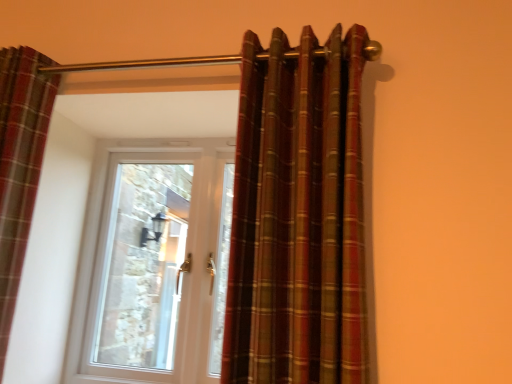
Describe the element at coordinates (298, 214) in the screenshot. The height and width of the screenshot is (384, 512). I see `plaid fabric curtain at center, positioned as the 1th curtain in right-to-left order` at that location.

Measure the distance between point (160, 292) and camera.

They are 14.54 feet apart.

Find the location of `white plastic door at center`. white plastic door at center is located at coordinates (149, 263).

The width and height of the screenshot is (512, 384). What do you see at coordinates (20, 164) in the screenshot? I see `plaid fabric curtain at left, which ranks as the second curtain in right-to-left order` at bounding box center [20, 164].

Locate an element on the screen. The width and height of the screenshot is (512, 384). plaid fabric curtain at center, positioned as the 1th curtain in right-to-left order is located at coordinates (298, 214).

Which object is wider, plaid fabric curtain at left, which is counted as the first curtain, starting from the left, or plaid fabric curtain at center, the 2th curtain in the left-to-right sequence?

plaid fabric curtain at center, the 2th curtain in the left-to-right sequence, is wider.

Considering their positions, is plaid fabric curtain at left, which is counted as the first curtain, starting from the left, located in front of or behind plaid fabric curtain at center, the 2th curtain in the left-to-right sequence?

In the image, plaid fabric curtain at left, which is counted as the first curtain, starting from the left, appears behind plaid fabric curtain at center, the 2th curtain in the left-to-right sequence.

Considering the sizes of plaid fabric curtain at left, which is counted as the first curtain, starting from the left, and plaid fabric curtain at center, the 2th curtain in the left-to-right sequence, in the image, is plaid fabric curtain at left, which is counted as the first curtain, starting from the left, taller or shorter than plaid fabric curtain at center, the 2th curtain in the left-to-right sequence,?

plaid fabric curtain at left, which is counted as the first curtain, starting from the left, is taller than plaid fabric curtain at center, the 2th curtain in the left-to-right sequence.

Find the location of a particular element. The image size is (512, 384). curtain located in front of the plaid fabric curtain at left, which is counted as the first curtain, starting from the left is located at coordinates (298, 214).

Between white plastic door at center and plaid fabric curtain at center, the 2th curtain in the left-to-right sequence, which one is positioned behind?

white plastic door at center is further from the camera.

From a real-world perspective, which is physically above, white plastic door at center or plaid fabric curtain at center, the 2th curtain in the left-to-right sequence?

plaid fabric curtain at center, the 2th curtain in the left-to-right sequence.

Looking at this image, can you tell me how much white plastic door at center and plaid fabric curtain at center, positioned as the 1th curtain in right-to-left order, differ in facing direction?

The facing directions of white plastic door at center and plaid fabric curtain at center, positioned as the 1th curtain in right-to-left order, are 1.79 degrees apart.

Considering the sizes of objects white plastic door at center and plaid fabric curtain at center, the 2th curtain in the left-to-right sequence, in the image provided, who is wider, white plastic door at center or plaid fabric curtain at center, the 2th curtain in the left-to-right sequence,?

plaid fabric curtain at center, the 2th curtain in the left-to-right sequence, is wider.

Measure the distance from plaid fabric curtain at left, which is counted as the first curtain, starting from the left, to white plastic door at center.

2.83 meters.

Considering the sizes of objects plaid fabric curtain at left, which is counted as the first curtain, starting from the left, and white plastic door at center in the image provided, who is thinner, plaid fabric curtain at left, which is counted as the first curtain, starting from the left, or white plastic door at center?

Thinner between the two is white plastic door at center.

What's the angular difference between plaid fabric curtain at left, which ranks as the second curtain in right-to-left order, and white plastic door at center's facing directions?

1.79 degrees.

Is plaid fabric curtain at left, which ranks as the second curtain in right-to-left order, outside of white plastic door at center?

Yes.

What's the angular difference between plaid fabric curtain at center, positioned as the 1th curtain in right-to-left order, and white plastic door at center's facing directions?

1.79 degrees.

Which curtain is the 2nd one when counting from the front of the white plastic door at center? Please provide its 2D coordinates.

[(298, 214)]

Based on the photo, are plaid fabric curtain at center, positioned as the 1th curtain in right-to-left order, and white plastic door at center making contact?

No, plaid fabric curtain at center, positioned as the 1th curtain in right-to-left order, is not beside white plastic door at center.

Can you confirm if plaid fabric curtain at center, the 2th curtain in the left-to-right sequence, is shorter than white plastic door at center?

Indeed, plaid fabric curtain at center, the 2th curtain in the left-to-right sequence, has a lesser height compared to white plastic door at center.

Can you confirm if plaid fabric curtain at center, the 2th curtain in the left-to-right sequence, is shorter than plaid fabric curtain at left, which is counted as the first curtain, starting from the left?

Yes.

Looking at this image, which object is wider, plaid fabric curtain at center, positioned as the 1th curtain in right-to-left order, or plaid fabric curtain at left, which ranks as the second curtain in right-to-left order?

Wider between the two is plaid fabric curtain at center, positioned as the 1th curtain in right-to-left order.

You are a GUI agent. You are given a task and a screenshot of the screen. Output one action in this format:
    pyautogui.click(x=<x>, y=<y>)
    Task: Click on the curtain in front of the plaid fabric curtain at left, which is counted as the first curtain, starting from the left
    The width and height of the screenshot is (512, 384).
    Given the screenshot: What is the action you would take?
    pyautogui.click(x=298, y=214)

From the image's perspective, does white plastic door at center appear lower than plaid fabric curtain at left, which ranks as the second curtain in right-to-left order?

Yes, from the image's perspective, white plastic door at center is beneath plaid fabric curtain at left, which ranks as the second curtain in right-to-left order.

Is white plastic door at center beside plaid fabric curtain at left, which is counted as the first curtain, starting from the left?

No, white plastic door at center is not beside plaid fabric curtain at left, which is counted as the first curtain, starting from the left.

Considering the points (120, 180) and (41, 117), which point is behind, point (120, 180) or point (41, 117)?

The point (120, 180) is behind.

Does white plastic door at center appear on the left side of plaid fabric curtain at left, which is counted as the first curtain, starting from the left?

No.

Where is `curtain below the plaid fabric curtain at center, the 2th curtain in the left-to-right sequence (from the image's perspective)`? curtain below the plaid fabric curtain at center, the 2th curtain in the left-to-right sequence (from the image's perspective) is located at coordinates (20, 164).

Locate an element on the screen. This screenshot has height=384, width=512. the 2nd curtain in front when counting from the white plastic door at center is located at coordinates (298, 214).

Considering their positions, is plaid fabric curtain at center, positioned as the 1th curtain in right-to-left order, positioned further to white plastic door at center than plaid fabric curtain at left, which is counted as the first curtain, starting from the left?

Based on the image, plaid fabric curtain at center, positioned as the 1th curtain in right-to-left order, appears to be further to white plastic door at center.

Which object lies nearer to the anchor point plaid fabric curtain at left, which is counted as the first curtain, starting from the left, white plastic door at center or plaid fabric curtain at center, the 2th curtain in the left-to-right sequence?

plaid fabric curtain at center, the 2th curtain in the left-to-right sequence, is closer to plaid fabric curtain at left, which is counted as the first curtain, starting from the left.

Looking at this image, from the image, which object appears to be nearer to white plastic door at center, plaid fabric curtain at left, which ranks as the second curtain in right-to-left order, or plaid fabric curtain at center, positioned as the 1th curtain in right-to-left order?

plaid fabric curtain at left, which ranks as the second curtain in right-to-left order, is positioned closer to the anchor white plastic door at center.

From the image, which object appears to be nearer to plaid fabric curtain at center, the 2th curtain in the left-to-right sequence, plaid fabric curtain at left, which is counted as the first curtain, starting from the left, or white plastic door at center?

plaid fabric curtain at left, which is counted as the first curtain, starting from the left.

Based on the photo, based on their spatial positions, is plaid fabric curtain at center, positioned as the 1th curtain in right-to-left order, or white plastic door at center further from plaid fabric curtain at left, which is counted as the first curtain, starting from the left?

The object further to plaid fabric curtain at left, which is counted as the first curtain, starting from the left, is white plastic door at center.

When comparing their distances from plaid fabric curtain at center, the 2th curtain in the left-to-right sequence, does white plastic door at center or plaid fabric curtain at left, which is counted as the first curtain, starting from the left, seem further?

white plastic door at center lies further to plaid fabric curtain at center, the 2th curtain in the left-to-right sequence, than the other object.

Where is `door located between plaid fabric curtain at left, which is counted as the first curtain, starting from the left, and plaid fabric curtain at center, the 2th curtain in the left-to-right sequence, in the left-right direction`? door located between plaid fabric curtain at left, which is counted as the first curtain, starting from the left, and plaid fabric curtain at center, the 2th curtain in the left-to-right sequence, in the left-right direction is located at coordinates (149, 263).